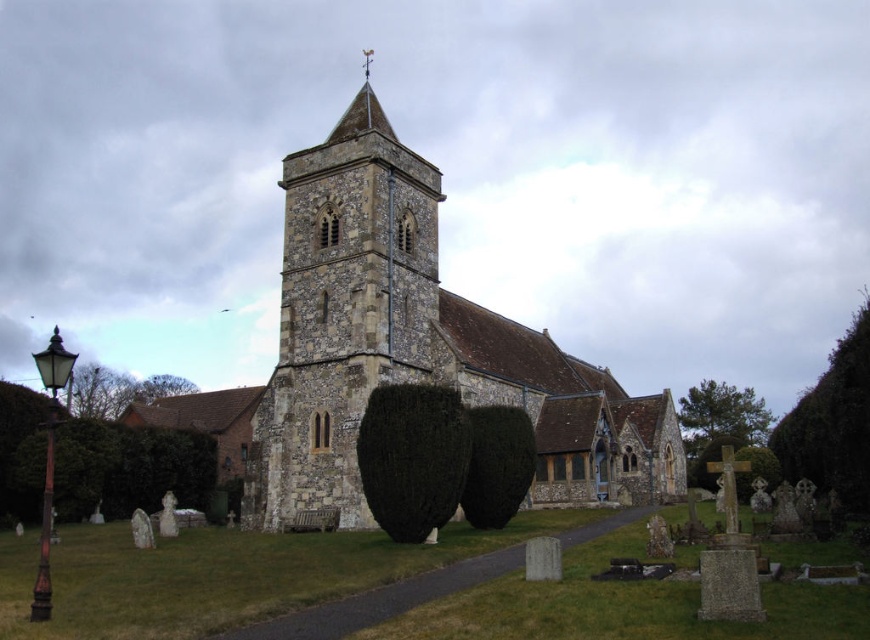
Question: Which of the following is the farthest from the observer?

Choices:
 (A) stone church at center
 (B) green leafy hedge at lower left
 (C) stone tower at center
 (D) green leafy hedge at right

Answer: (B)

Question: Is dark green bush at center further to camera compared to green leafy hedge at right?

Choices:
 (A) no
 (B) yes

Answer: (A)

Question: Can you confirm if stone church at center is positioned below dark green bush at center?

Choices:
 (A) yes
 (B) no

Answer: (B)

Question: Does stone tower at center appear on the left side of green leafy hedge at right?

Choices:
 (A) yes
 (B) no

Answer: (A)

Question: Which of the following is the closest to the observer?

Choices:
 (A) green leafy hedge at right
 (B) dark green bush at center
 (C) stone tower at center

Answer: (B)

Question: Considering the real-world distances, which object is closest to the green leafy hedge at lower left?

Choices:
 (A) stone church at center
 (B) dark green bush at center
 (C) stone tower at center

Answer: (C)